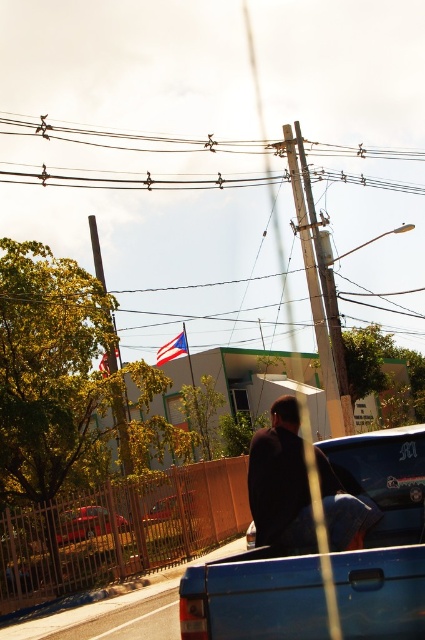
Which is behind, point (348, 422) or point (164, 356)?

Point (164, 356)

Is wooden utility pole at center positioned in front of blue fabric flag at upper center?

Yes, it is in front of blue fabric flag at upper center.

Measure the distance between wooden utility pole at center and camera.

wooden utility pole at center and camera are 15.86 meters apart.

The image size is (425, 640). Identify the location of wooden utility pole at center. (319, 301).

Between wooden utility pole at center and metallic red car at center, which one is positioned lower?

Positioned lower is metallic red car at center.

Does point (334, 385) come in front of point (164, 500)?

No, it is behind (164, 500).

This screenshot has height=640, width=425. What are the coordinates of `wooden utility pole at center` in the screenshot? It's located at (319, 301).

Can you confirm if metallic flagpole at upper left is thinner than metallic red car at center?

Incorrect, metallic flagpole at upper left's width is not less than metallic red car at center's.

Who is taller, metallic flagpole at upper left or metallic red car at center?

With more height is metallic flagpole at upper left.

Is point (116, 413) farther from camera compared to point (189, 497)?

Yes, it is behind point (189, 497).

Locate an element on the screen. metallic flagpole at upper left is located at coordinates (121, 428).